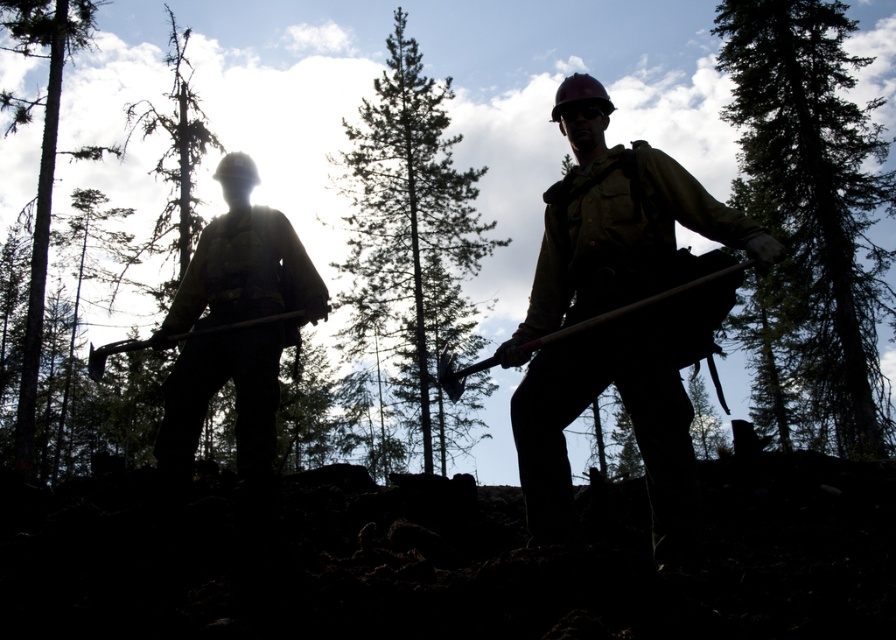
In the scene shown: Which is above, matte black axe at center or silhouette pine tree at left?

Positioned higher is silhouette pine tree at left.

Is matte black axe at center to the left of silhouette pine tree at left from the viewer's perspective?

No, matte black axe at center is not to the left of silhouette pine tree at left.

In order to click on matte black axe at center in this screenshot , I will do `click(619, 224)`.

What do you see at coordinates (812, 212) in the screenshot?
I see `green textured tree at upper right` at bounding box center [812, 212].

Looking at this image, is green textured tree at upper right taller than matte yellow safety vest at left?

Indeed, green textured tree at upper right has a greater height compared to matte yellow safety vest at left.

Image resolution: width=896 pixels, height=640 pixels. Describe the element at coordinates (812, 212) in the screenshot. I see `green textured tree at upper right` at that location.

The height and width of the screenshot is (640, 896). I want to click on green textured tree at upper right, so click(812, 212).

Does green textured tree at upper right have a smaller size compared to silhouette pine tree at left?

Indeed, green textured tree at upper right has a smaller size compared to silhouette pine tree at left.

Describe the element at coordinates (812, 212) in the screenshot. I see `green textured tree at upper right` at that location.

Where is `green textured tree at upper right`? The image size is (896, 640). green textured tree at upper right is located at coordinates (812, 212).